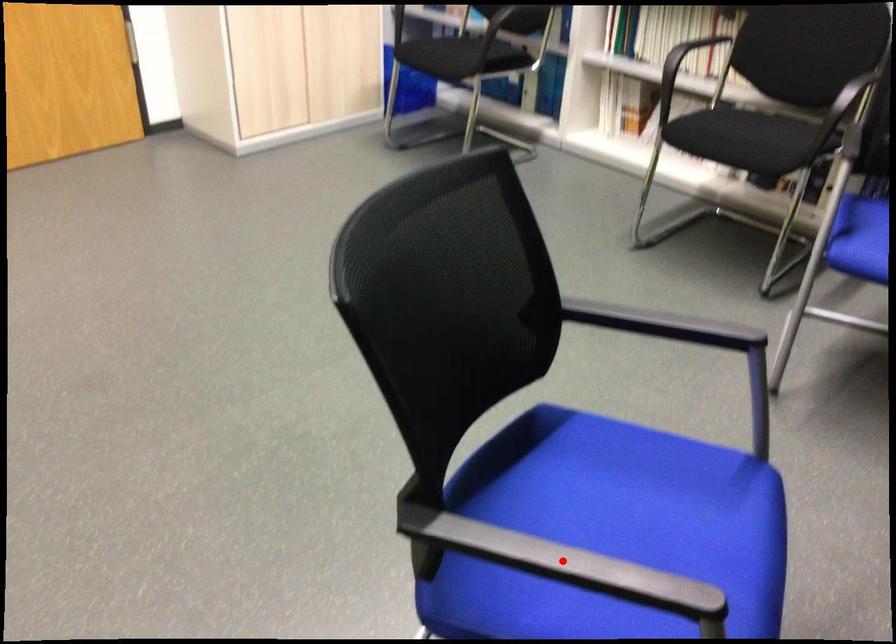
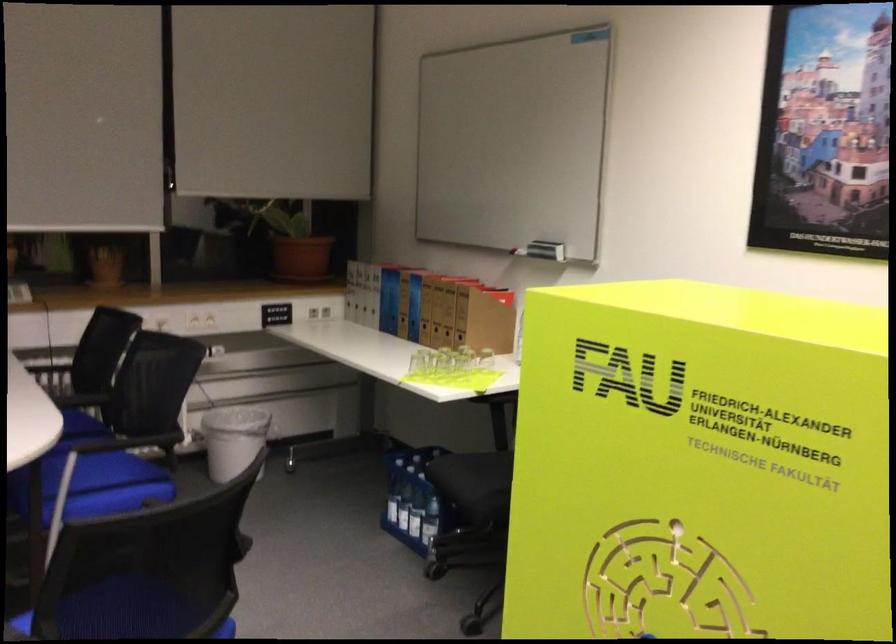
Question: I am providing you with two images of the same scene from different viewpoints. A red point is marked on the first image. Is the red point's position out of view in image 2?

Choices:
 (A) Yes
 (B) No

Answer: (A)